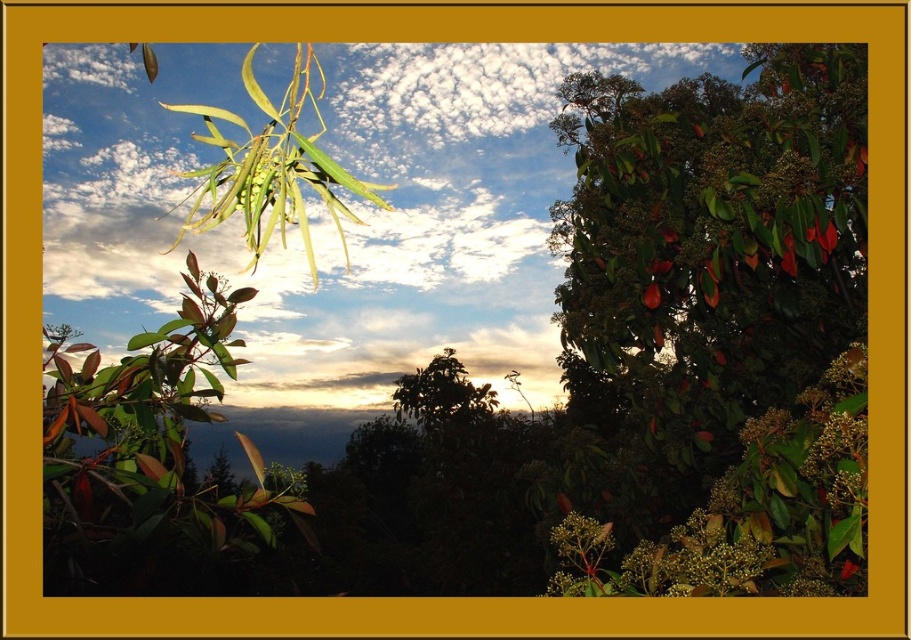
Question: Which of the following is the closest to the observer?

Choices:
 (A) (658, 378)
 (B) (77, 220)

Answer: (A)

Question: Estimate the real-world distances between objects in this image. Which object is farther from the white fluffy cloud at upper center?

Choices:
 (A) shiny brown leaves at left
 (B) green glossy leaves at upper center

Answer: (A)

Question: Observing the image, what is the correct spatial positioning of white fluffy cloud at upper center in reference to shiny brown leaves at left?

Choices:
 (A) left
 (B) right

Answer: (B)

Question: Which of the following is the farthest from the observer?

Choices:
 (A) (80, 467)
 (B) (626, 358)
 (C) (413, 356)

Answer: (C)

Question: Considering the relative positions of white fluffy cloud at upper center and shiny brown leaves at left in the image provided, where is white fluffy cloud at upper center located with respect to shiny brown leaves at left?

Choices:
 (A) above
 (B) below

Answer: (A)

Question: Does green glossy leaves at upper center have a smaller size compared to shiny brown leaves at left?

Choices:
 (A) yes
 (B) no

Answer: (B)